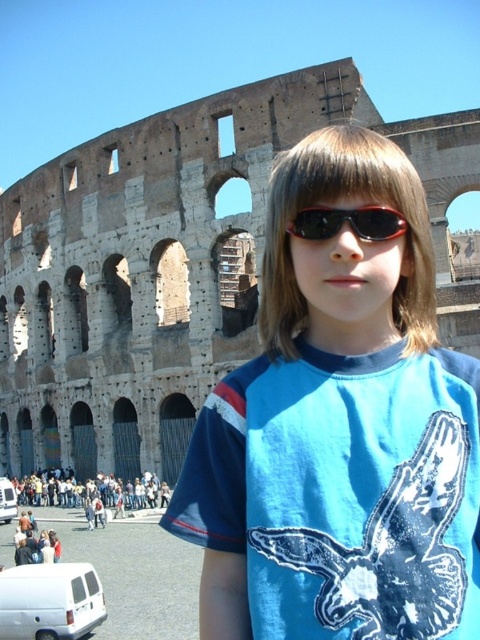
Question: Can you confirm if blue cotton shirt at center is bigger than black plastic sunglasses at center?

Choices:
 (A) no
 (B) yes

Answer: (B)

Question: Does blue cotton shirt at center have a smaller size compared to black plastic sunglasses at center?

Choices:
 (A) no
 (B) yes

Answer: (A)

Question: Can you confirm if blue cotton shirt at center is smaller than black plastic sunglasses at center?

Choices:
 (A) no
 (B) yes

Answer: (A)

Question: Which of the following is the farthest from the observer?

Choices:
 (A) (253, 525)
 (B) (365, 241)

Answer: (B)

Question: Which of the following is the farthest from the observer?

Choices:
 (A) (278, 193)
 (B) (381, 232)

Answer: (A)

Question: Which point is closer to the camera taking this photo?

Choices:
 (A) coord(385,536)
 (B) coord(384,237)

Answer: (A)